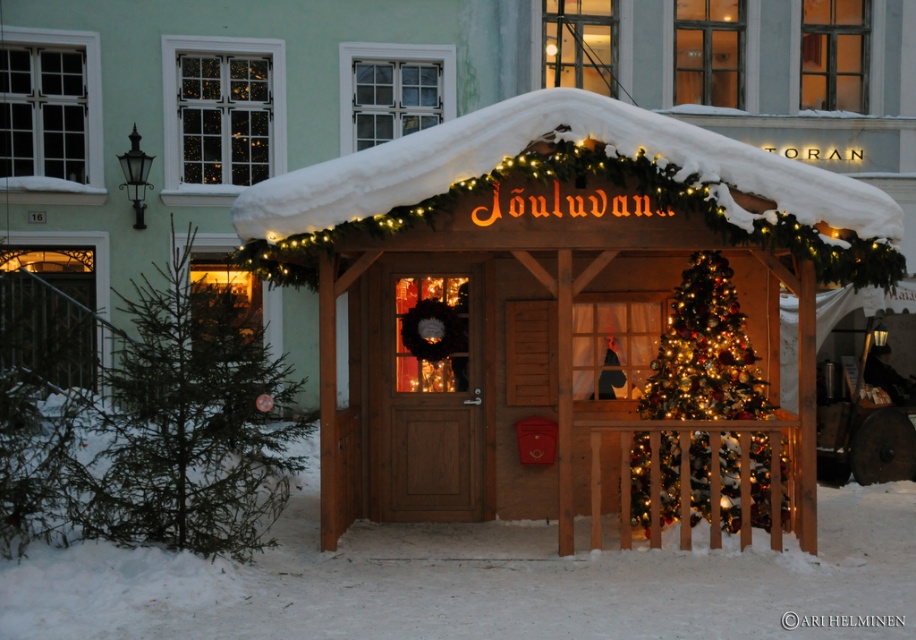
You are standing in the winter town square and see the point marked at coordinates (x=576, y=186). Based on the scene description, where is this point located?

The point is located on the snow covered wooden canopy at center.